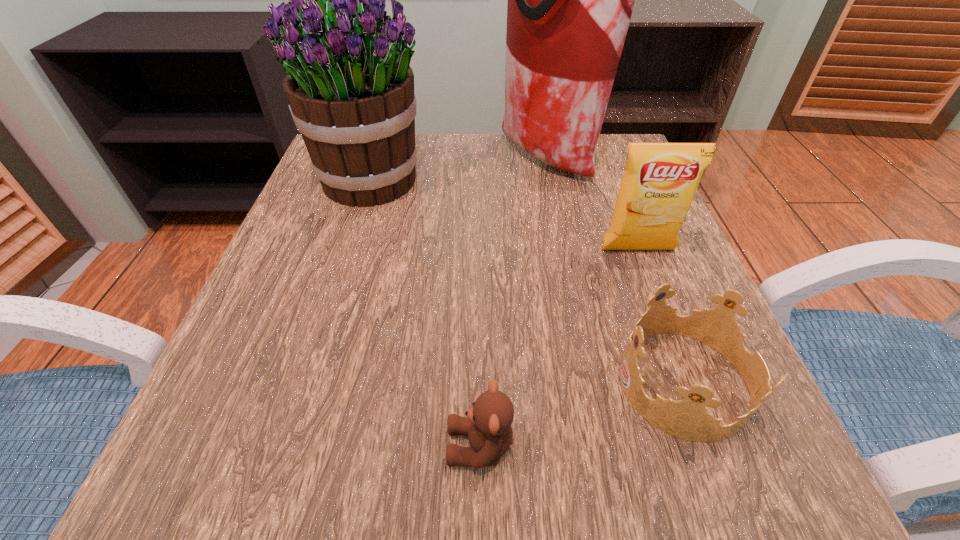
Where is `free spot between the grocery bag and the tiara`? The height and width of the screenshot is (540, 960). free spot between the grocery bag and the tiara is located at coordinates [615, 270].

Where is `object that stands as the third closest to the tiara`? The width and height of the screenshot is (960, 540). object that stands as the third closest to the tiara is located at coordinates (570, 0).

At what (x,y) coordinates should I click in order to perform the action: click on the fourth closest object relative to the crisp (potato chip). Please return your answer as a coordinate pair (x, y). Looking at the image, I should click on (488, 423).

Image resolution: width=960 pixels, height=540 pixels. In order to click on free space that satisfies the following two spatial constraints: 1. on the front of the third tallest object with the logo; 2. on the front-facing side of the tiara in this screenshot , I will do `click(688, 382)`.

In order to click on free location that satisfies the following two spatial constraints: 1. on the front of the third shortest object with the logo; 2. on the face of the fourth object from right to left in this screenshot , I will do `click(712, 447)`.

At what (x,y) coordinates should I click in order to perform the action: click on free spot that satisfies the following two spatial constraints: 1. on the front of the crisp (potato chip) with the logo; 2. on the front-facing side of the tiara. Please return your answer as a coordinate pair (x, y). The height and width of the screenshot is (540, 960). Looking at the image, I should click on (688, 382).

Where is `vacant space that satisfies the following two spatial constraints: 1. on the front of the third shortest object with the logo; 2. on the front-facing side of the tiara`? The image size is (960, 540). vacant space that satisfies the following two spatial constraints: 1. on the front of the third shortest object with the logo; 2. on the front-facing side of the tiara is located at coordinates (688, 382).